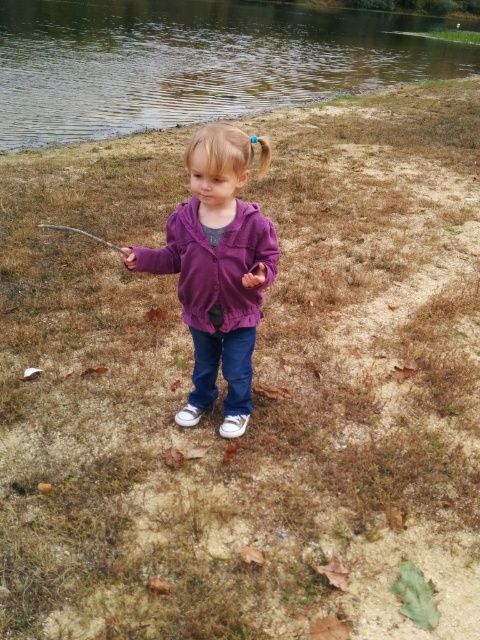
Locate an element on the screen. This screenshot has width=480, height=640. purple fleece sweatshirt at center is located at coordinates (215, 266).

Identify the location of purple fleece sweatshirt at center. (215, 266).

Is purple fleece jacket at center shorter than brown wooden fishing pole at lower left?

No.

Can you confirm if purple fleece jacket at center is bigger than brown wooden fishing pole at lower left?

Yes.

Is point (216, 220) positioned before point (50, 227)?

Yes.

Locate an element on the screen. The width and height of the screenshot is (480, 640). purple fleece jacket at center is located at coordinates (216, 272).

At what (x,y) coordinates should I click in order to perform the action: click on greenish reflective water at upper center. Please return your answer as a coordinate pair (x, y). This screenshot has height=640, width=480. Looking at the image, I should click on (194, 61).

Is greenish reflective water at upper center thinner than purple fleece sweatshirt at center?

No.

Find the location of a particular element. greenish reflective water at upper center is located at coordinates (194, 61).

Find the location of a particular element. The width and height of the screenshot is (480, 640). greenish reflective water at upper center is located at coordinates (194, 61).